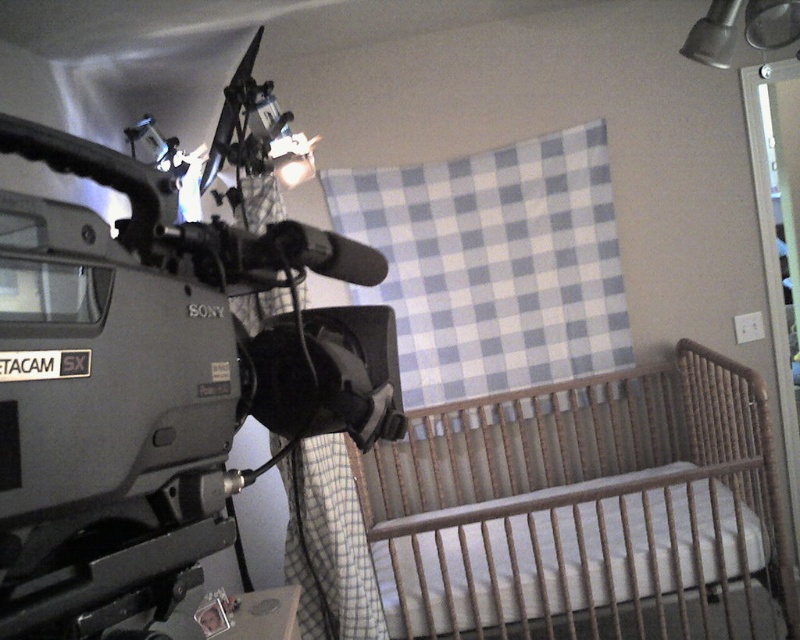
Question: Which object appears farthest from the camera in this image?

Choices:
 (A) metallic gray video camera at left
 (B) wooden crib at lower right
 (C) wooden changing table at lower center

Answer: (B)

Question: Which object is the farthest from the metallic gray video camera at left?

Choices:
 (A) wooden changing table at lower center
 (B) wooden crib at lower right

Answer: (B)

Question: Can you confirm if wooden crib at lower right is positioned to the right of wooden changing table at lower center?

Choices:
 (A) no
 (B) yes

Answer: (B)

Question: Does wooden crib at lower right lie in front of wooden changing table at lower center?

Choices:
 (A) yes
 (B) no

Answer: (B)

Question: Which of these objects is positioned closest to the wooden crib at lower right?

Choices:
 (A) wooden changing table at lower center
 (B) metallic gray video camera at left

Answer: (A)

Question: Is metallic gray video camera at left in front of wooden crib at lower right?

Choices:
 (A) no
 (B) yes

Answer: (B)